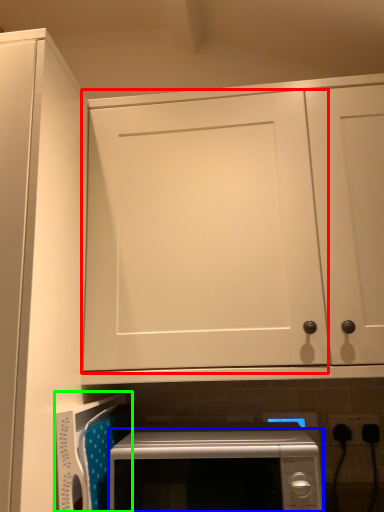
Question: Based on their relative distances, which object is farther from door (highlighted by a red box)? Choose from microwave oven (highlighted by a blue box) and appliance (highlighted by a green box).

Choices:
 (A) microwave oven
 (B) appliance

Answer: (B)